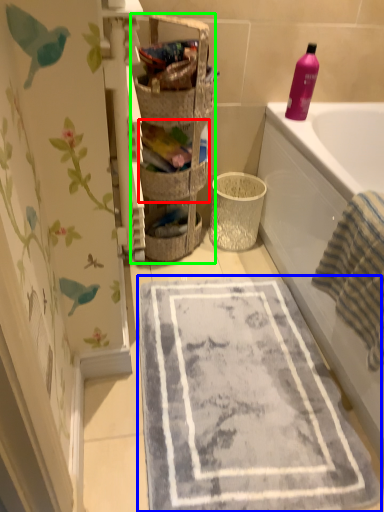
Question: Considering the real-world distances, which object is farthest from basket (highlighted by a red box)? bath mat (highlighted by a blue box) or shelf (highlighted by a green box)?

Choices:
 (A) bath mat
 (B) shelf

Answer: (A)